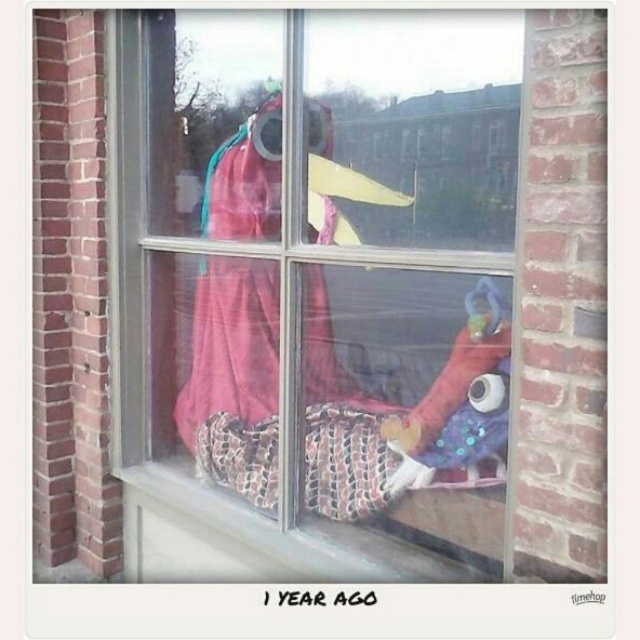
Question: Estimate the real-world distances between objects in this image. Which object is closer to the white textured stone at lower center?

Choices:
 (A) shiny blue fabric toy at center
 (B) matte pink fabric at center

Answer: (A)

Question: Can you confirm if matte pink fabric at center is smaller than white textured stone at lower center?

Choices:
 (A) yes
 (B) no

Answer: (B)

Question: Which point is closer to the camera?

Choices:
 (A) matte pink fabric at center
 (B) white textured stone at lower center
 (C) shiny blue fabric toy at center

Answer: (A)

Question: Which object is farther from the camera taking this photo?

Choices:
 (A) shiny blue fabric toy at center
 (B) white textured stone at lower center
 (C) matte pink fabric at center

Answer: (B)

Question: Considering the relative positions of matte pink fabric at center and shiny blue fabric toy at center in the image provided, where is matte pink fabric at center located with respect to shiny blue fabric toy at center?

Choices:
 (A) below
 (B) above

Answer: (B)

Question: Is matte pink fabric at center to the left of shiny blue fabric toy at center from the viewer's perspective?

Choices:
 (A) no
 (B) yes

Answer: (B)